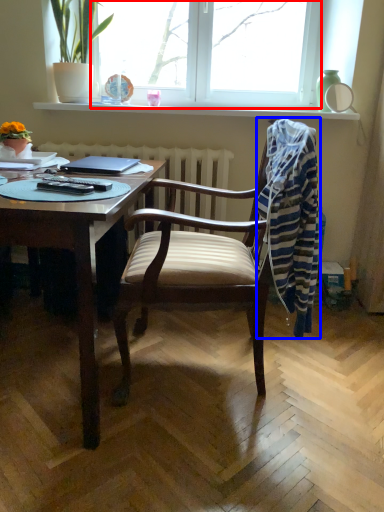
Question: Which object appears farthest to the camera in this image, window (highlighted by a red box) or laundry (highlighted by a blue box)?

Choices:
 (A) window
 (B) laundry

Answer: (A)